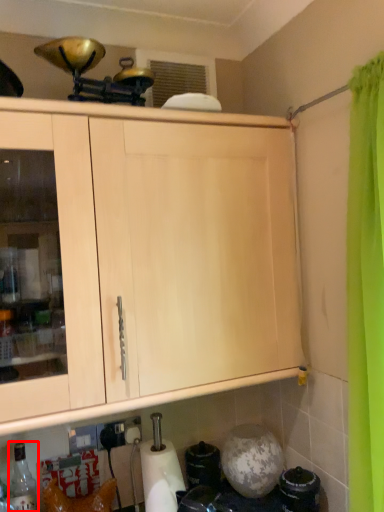
Question: From the image's perspective, considering the relative positions of bottle (annotated by the red box) and paper towel in the image provided, where is bottle (annotated by the red box) located with respect to the staircase?

Choices:
 (A) below
 (B) above

Answer: (A)